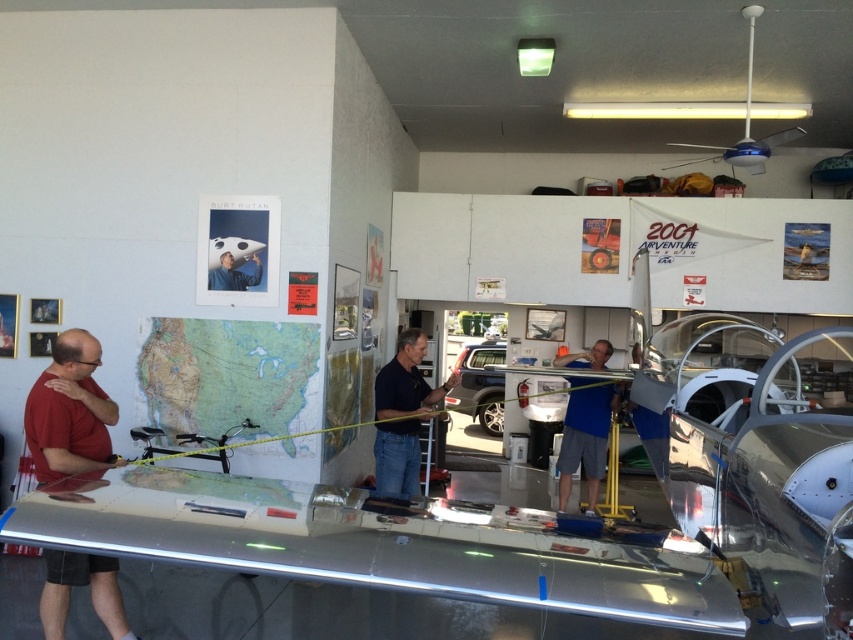
Looking at this image, you are a worker in the hangar and need to access the engine compartment located above the black matte shirt at center. Can you reach it without moving the matte black airplane at center?

The black matte shirt at center is positioned under the matte black airplane at center, so the airplane is blocking access to the engine compartment. You would need to move the airplane to reach it.

You are a worker in the hangar and need to determine which shirt is wider between the black matte shirt at center and the blue fabric shirt at center. Can you confirm which one is wider?

The black matte shirt at center is wider than the blue fabric shirt at center according to the description.

You are a new worker in the hangar and need to approach both the red matte shirt at left and the black matte shirt at center for instructions. Which worker should you approach first based on their proximity to you?

You should approach the red matte shirt at left first because they are closer to you than the black matte shirt at center.